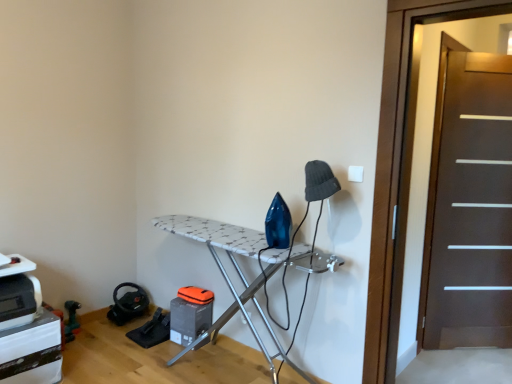
Describe the element at coordinates (399, 170) in the screenshot. I see `dark brown wooden screen door at right, acting as the first screen door starting from the front` at that location.

In order to face white textured ironing board at center, should I rotate leftwards or rightwards?

You should look left and rotate roughly 3.625 degrees.

Describe the element at coordinates (218, 259) in the screenshot. This screenshot has width=512, height=384. I see `white textured ironing board at center` at that location.

The width and height of the screenshot is (512, 384). What are the coordinates of `dark brown wooden screen door at right, the 2th screen door when ordered from back to front` in the screenshot? It's located at (x=399, y=170).

Is the depth of white textured ironing board at center greater than that of dark brown wooden screen door at right, acting as the first screen door starting from the front?

Yes, it is.

Which of these two, white textured ironing board at center or dark brown wooden screen door at right, the 2th screen door when ordered from back to front, is wider?

white textured ironing board at center is wider.

From the image's perspective, is white textured ironing board at center above dark brown wooden screen door at right, acting as the first screen door starting from the front?

No, from the image's perspective, white textured ironing board at center is not above dark brown wooden screen door at right, acting as the first screen door starting from the front.

Which point is more distant from viewer, (x=437, y=318) or (x=231, y=312)?

The point (x=437, y=318) is farther from the camera.

Considering the relative positions of dark brown wood screen door at right, which is the first screen door from back to front, and white textured ironing board at center in the image provided, is dark brown wood screen door at right, which is the first screen door from back to front, behind white textured ironing board at center?

Yes, dark brown wood screen door at right, which is the first screen door from back to front, is further from the camera.

At what (x,y) coordinates should I click in order to perform the action: click on screen door that is behind the white textured ironing board at center. Please return your answer as a coordinate pair (x, y). This screenshot has width=512, height=384. Looking at the image, I should click on (471, 206).

Is dark brown wood screen door at right, which is counted as the second screen door, starting from the front, to the right of dark brown wooden screen door at right, arranged as the second screen door when viewed from the right, from the viewer's perspective?

Indeed, dark brown wood screen door at right, which is counted as the second screen door, starting from the front, is positioned on the right side of dark brown wooden screen door at right, arranged as the second screen door when viewed from the right.

Is dark brown wooden screen door at right, arranged as the 1th screen door when viewed from the left, at the back of dark brown wood screen door at right, which is the first screen door from back to front?

That's not correct — dark brown wood screen door at right, which is the first screen door from back to front, is not looking away from dark brown wooden screen door at right, arranged as the 1th screen door when viewed from the left.

Is dark brown wood screen door at right, which is the first screen door from back to front, in front of or behind dark brown wooden screen door at right, arranged as the second screen door when viewed from the right, in the image?

dark brown wood screen door at right, which is the first screen door from back to front, is behind dark brown wooden screen door at right, arranged as the second screen door when viewed from the right.

From the image's perspective, is dark brown wood screen door at right, which is counted as the second screen door, starting from the front, located beneath dark brown wooden screen door at right, the 2th screen door when ordered from back to front?

Indeed, from the image's perspective, dark brown wood screen door at right, which is counted as the second screen door, starting from the front, is shown beneath dark brown wooden screen door at right, the 2th screen door when ordered from back to front.

At what (x,y) coordinates should I click in order to perform the action: click on the 1st screen door to the right of the white textured ironing board at center, starting your count from the anchor. Please return your answer as a coordinate pair (x, y). The image size is (512, 384). Looking at the image, I should click on point(399,170).

Between point (376, 374) and point (181, 231), which one is positioned in front?

The point (376, 374) is closer.

Is dark brown wooden screen door at right, acting as the first screen door starting from the front, taller or shorter than white textured ironing board at center?

In the image, dark brown wooden screen door at right, acting as the first screen door starting from the front, appears to be taller than white textured ironing board at center.

From the image's perspective, is dark brown wooden screen door at right, arranged as the 1th screen door when viewed from the left, positioned above or below dark brown wood screen door at right, positioned as the first screen door in right-to-left order?

dark brown wooden screen door at right, arranged as the 1th screen door when viewed from the left, is above dark brown wood screen door at right, positioned as the first screen door in right-to-left order.

Is dark brown wooden screen door at right, arranged as the second screen door when viewed from the right, to the left or to the right of dark brown wood screen door at right, the second screen door from the left, in the image?

dark brown wooden screen door at right, arranged as the second screen door when viewed from the right, is to the left of dark brown wood screen door at right, the second screen door from the left.

The width and height of the screenshot is (512, 384). Identify the location of screen door positioned vertically above the dark brown wood screen door at right, the second screen door from the left (from a real-world perspective). (399, 170).

Is dark brown wooden screen door at right, acting as the first screen door starting from the front, oriented towards dark brown wood screen door at right, which is the first screen door from back to front?

Yes, dark brown wooden screen door at right, acting as the first screen door starting from the front, is turned towards dark brown wood screen door at right, which is the first screen door from back to front.

Who is more distant, white textured ironing board at center or dark brown wood screen door at right, which is the first screen door from back to front?

dark brown wood screen door at right, which is the first screen door from back to front.

Considering the relative sizes of white textured ironing board at center and dark brown wood screen door at right, the second screen door from the left, in the image provided, is white textured ironing board at center smaller than dark brown wood screen door at right, the second screen door from the left,?

No, white textured ironing board at center is not smaller than dark brown wood screen door at right, the second screen door from the left.

In the scene shown: From a real-world perspective, is white textured ironing board at center above or below dark brown wood screen door at right, which is counted as the second screen door, starting from the front?

Clearly, from a real-world perspective, white textured ironing board at center is below dark brown wood screen door at right, which is counted as the second screen door, starting from the front.

From the image's perspective, is white textured ironing board at center below dark brown wood screen door at right, which is counted as the second screen door, starting from the front?

Indeed, from the image's perspective, white textured ironing board at center is shown beneath dark brown wood screen door at right, which is counted as the second screen door, starting from the front.

Where is `furniture that appears behind the dark brown wooden screen door at right, the 2th screen door when ordered from back to front`? The height and width of the screenshot is (384, 512). furniture that appears behind the dark brown wooden screen door at right, the 2th screen door when ordered from back to front is located at coordinates (218, 259).

Image resolution: width=512 pixels, height=384 pixels. Find the location of `screen door that is the 1st object above the white textured ironing board at center (from a real-world perspective)`. screen door that is the 1st object above the white textured ironing board at center (from a real-world perspective) is located at coordinates (471, 206).

Considering their positions, is dark brown wood screen door at right, the second screen door from the left, positioned further to dark brown wooden screen door at right, the 2th screen door when ordered from back to front, than white textured ironing board at center?

The object further to dark brown wooden screen door at right, the 2th screen door when ordered from back to front, is dark brown wood screen door at right, the second screen door from the left.

Considering their positions, is dark brown wooden screen door at right, arranged as the second screen door when viewed from the right, positioned closer to white textured ironing board at center than dark brown wood screen door at right, the second screen door from the left?

Based on the image, dark brown wooden screen door at right, arranged as the second screen door when viewed from the right, appears to be nearer to white textured ironing board at center.

Estimate the real-world distances between objects in this image. Which object is further from dark brown wooden screen door at right, arranged as the second screen door when viewed from the right, white textured ironing board at center or dark brown wood screen door at right, the second screen door from the left?

dark brown wood screen door at right, the second screen door from the left.

From the image, which object appears to be nearer to dark brown wood screen door at right, which is counted as the second screen door, starting from the front, white textured ironing board at center or dark brown wooden screen door at right, arranged as the second screen door when viewed from the right?

dark brown wooden screen door at right, arranged as the second screen door when viewed from the right.

Based on their spatial positions, is dark brown wood screen door at right, which is counted as the second screen door, starting from the front, or dark brown wooden screen door at right, acting as the first screen door starting from the front, closer to white textured ironing board at center?

dark brown wooden screen door at right, acting as the first screen door starting from the front, lies closer to white textured ironing board at center than the other object.

Based on their spatial positions, is dark brown wooden screen door at right, arranged as the second screen door when viewed from the right, or white textured ironing board at center further from dark brown wood screen door at right, which is counted as the second screen door, starting from the front?

white textured ironing board at center is further to dark brown wood screen door at right, which is counted as the second screen door, starting from the front.

This screenshot has height=384, width=512. Find the location of `screen door located between white textured ironing board at center and dark brown wood screen door at right, which is the first screen door from back to front, in the left-right direction`. screen door located between white textured ironing board at center and dark brown wood screen door at right, which is the first screen door from back to front, in the left-right direction is located at coordinates (399, 170).